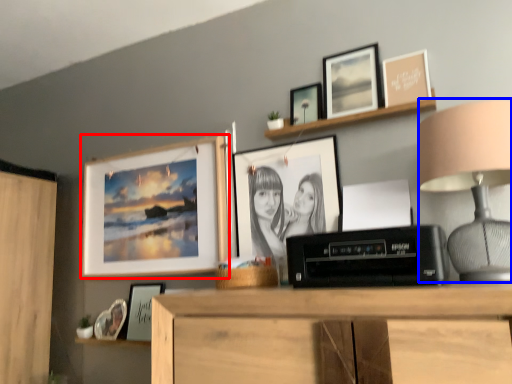
Question: Which object appears closest to the camera in this image, picture frame (highlighted by a red box) or table lamp (highlighted by a blue box)?

Choices:
 (A) picture frame
 (B) table lamp

Answer: (B)